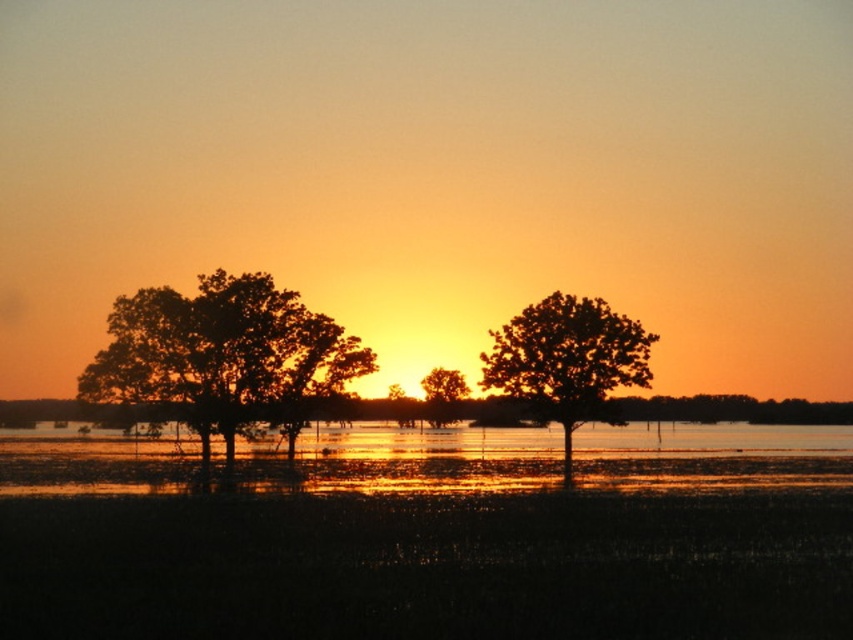
Is silhouette tree at left thinner than silhouette wood tree at center?

No.

Is the position of silhouette tree at left more distant than that of silhouette wood tree at center?

Yes, it is behind silhouette wood tree at center.

Is point (358, 355) positioned after point (607, 417)?

No, it is in front of (607, 417).

At what (x,y) coordinates should I click in order to perform the action: click on silhouette tree at left. Please return your answer as a coordinate pair (x, y). Looking at the image, I should click on pyautogui.click(x=223, y=355).

Based on the photo, does shiny reflective water at center appear on the left side of silhouette wood tree at center?

Correct, you'll find shiny reflective water at center to the left of silhouette wood tree at center.

Who is lower down, shiny reflective water at center or silhouette wood tree at center?

shiny reflective water at center is below.

You are a GUI agent. You are given a task and a screenshot of the screen. Output one action in this format:
    pyautogui.click(x=<x>, y=<y>)
    Task: Click on the shiny reflective water at center
    The height and width of the screenshot is (640, 853).
    Given the screenshot: What is the action you would take?
    pyautogui.click(x=401, y=461)

Based on the photo, can you confirm if shiny reflective water at center is positioned below green leafy tree at center?

Indeed, shiny reflective water at center is positioned under green leafy tree at center.

The width and height of the screenshot is (853, 640). What do you see at coordinates (401, 461) in the screenshot? I see `shiny reflective water at center` at bounding box center [401, 461].

This screenshot has width=853, height=640. I want to click on shiny reflective water at center, so click(401, 461).